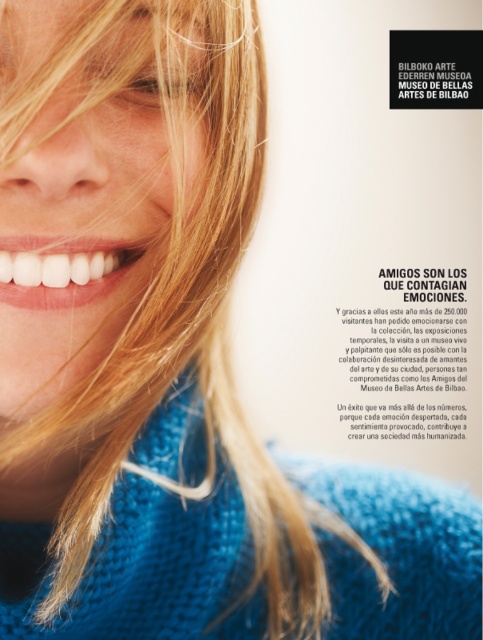
You are an artist sketching this portrait and want to ensure proper depth perception. Which object is nearer to you between the blonde hair at upper left and the white glossy teeth at center?

The blonde hair at upper left is closer to the viewer than the white glossy teeth at center, so the blonde hair at upper left is nearer.

You are a photographer trying to capture a closeup of the person in the image. You want to ensure the blonde hair at upper left is centered in the frame. What adjustment should you make to the camera position?

To center the blonde hair at upper left in the frame, you should move the camera to the left since the current position has the hair at coordinates (x=84, y=241), which is to the left side of the image.

You are an artist trying to sketch this person. You need to decide the placement of the blonde hair at upper left and white glossy teeth at center. Which object should you draw first if you want to ensure proper proportions?

The blonde hair at upper left should be drawn first because it might be wider than the white glossy teeth at center, so establishing its width will help in proportioning the teeth correctly.